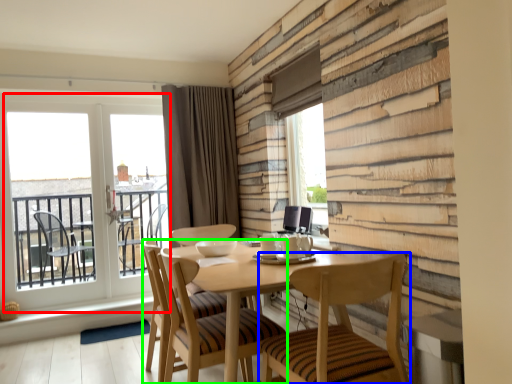
Question: Considering the real-world distances, which object is farthest from window (highlighted by a red box)? chair (highlighted by a blue box) or chair (highlighted by a green box)?

Choices:
 (A) chair
 (B) chair

Answer: (A)